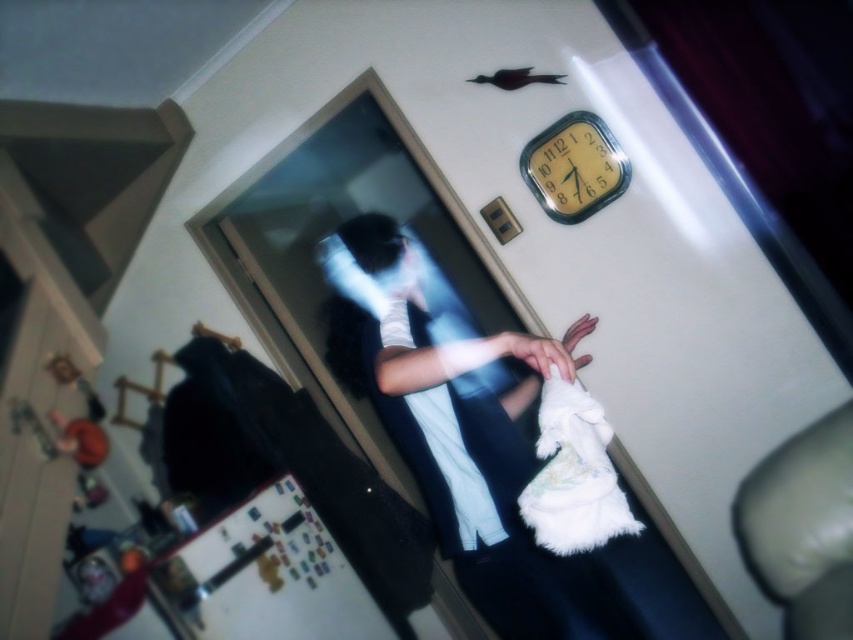
Question: Which of the following is the farthest from the observer?

Choices:
 (A) yellow matte clock at upper center
 (B) white fluffy towel at center

Answer: (A)

Question: Does white fluffy towel at center come in front of yellow matte clock at upper center?

Choices:
 (A) no
 (B) yes

Answer: (B)

Question: Does white fluffy towel at center have a smaller size compared to yellow matte clock at upper center?

Choices:
 (A) no
 (B) yes

Answer: (A)

Question: Can you confirm if white fluffy towel at center is positioned to the left of yellow matte clock at upper center?

Choices:
 (A) no
 (B) yes

Answer: (B)